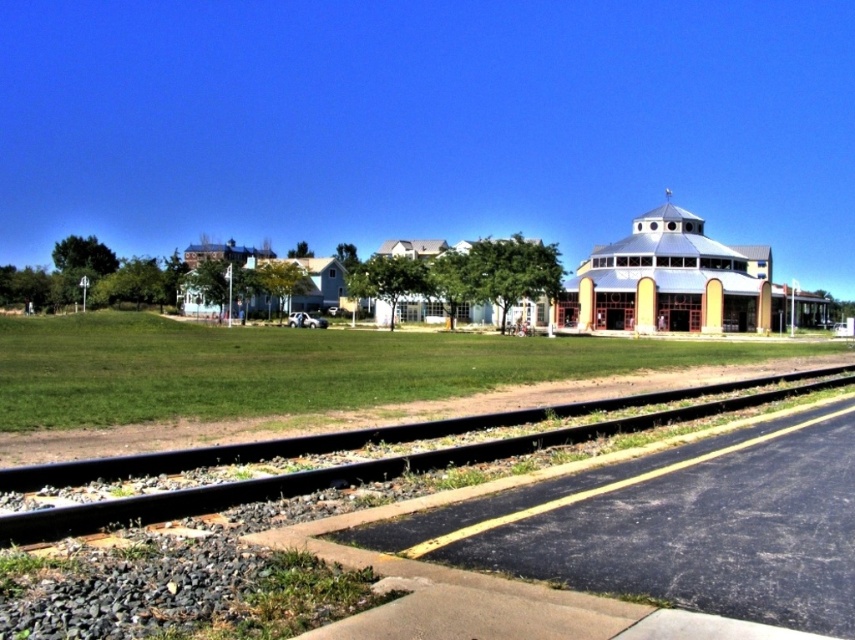
You are a city planner designing a new park in this area. The park must include both the metallic blue dome at center and the black metal train track at lower center. Which object should be placed first to ensure proper spacing between them?

The metallic blue dome at center should be placed first because its width is larger than the black metal train track at lower center, so allocating space for it first ensures there is enough room for both objects.

You are standing at the point marked by the coordinates point (679, 282) in the image. What object are you facing?

The point (679, 282) corresponds to the metallic blue dome at center, so you are facing the metallic blue dome at center.

You are standing at the point closer to the camera between the two points, point (x=588, y=294) and point (x=765, y=380). Which point are you standing at?

You are standing at point (x=588, y=294) because it is closer to the camera compared to point (x=765, y=380).